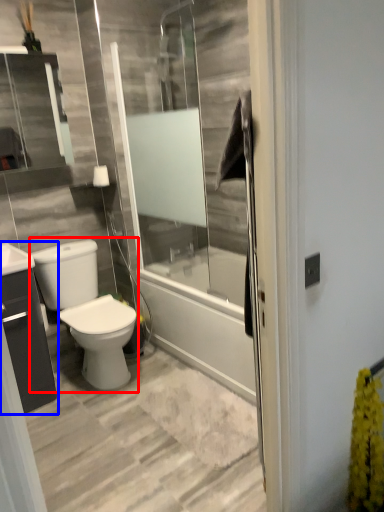
Question: Which object appears closest to the camera in this image, gray (highlighted by a red box) or bathroom cabinet (highlighted by a blue box)?

Choices:
 (A) gray
 (B) bathroom cabinet

Answer: (B)